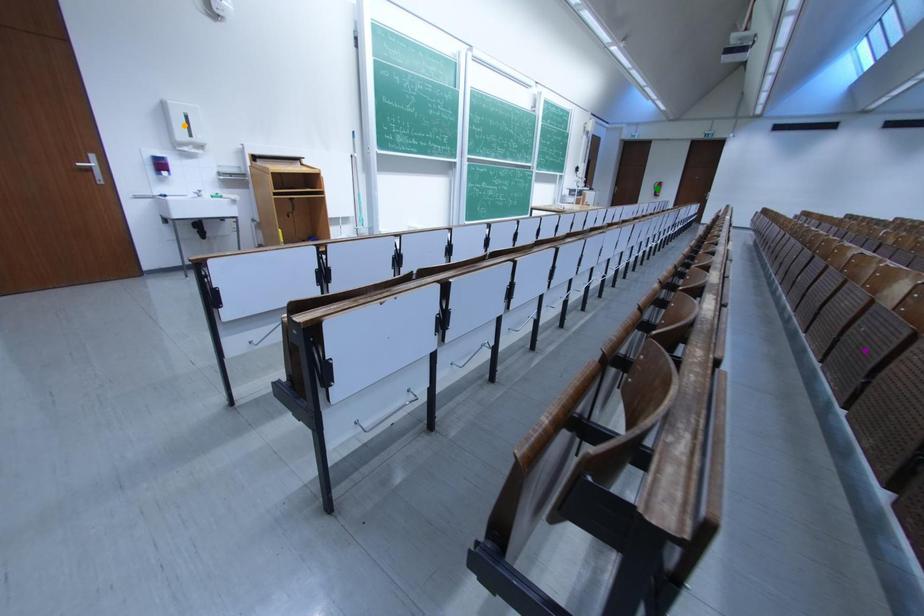
Looking at this image, order these from nearest to farthest:
- orange point
- green point
- purple point

purple point < orange point < green point